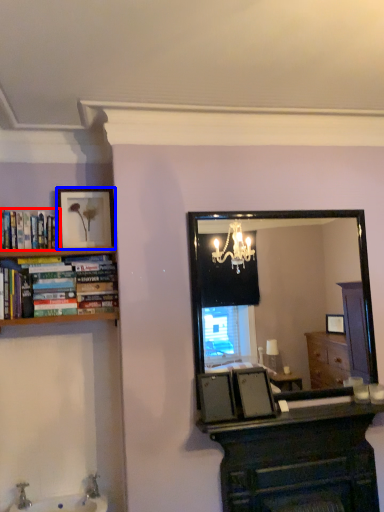
Question: Which object appears closest to the camera in this image, book (highlighted by a red box) or picture frame (highlighted by a blue box)?

Choices:
 (A) book
 (B) picture frame

Answer: (A)